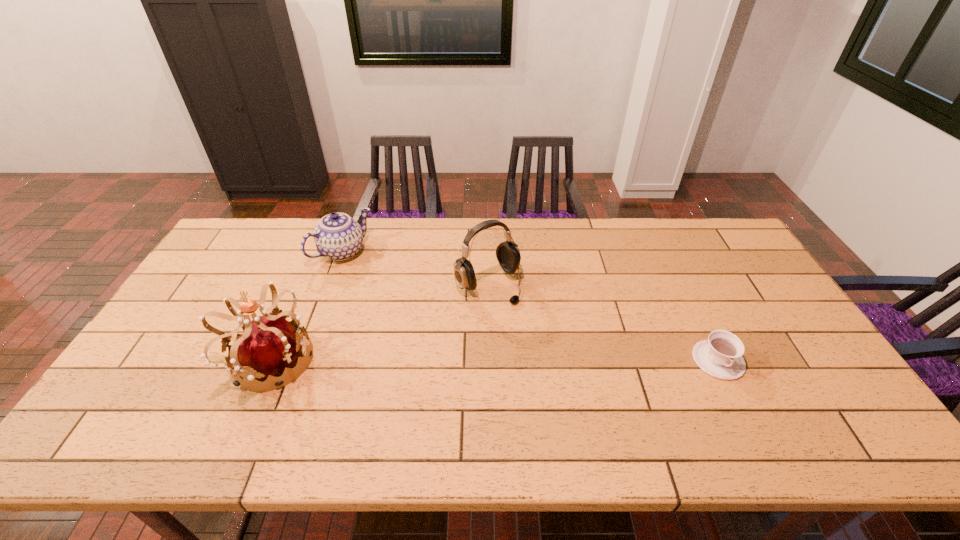
Find the location of a particular element. tiara is located at coordinates [x=270, y=344].

Locate an element on the screen. Image resolution: width=960 pixels, height=540 pixels. teacup is located at coordinates [x=720, y=356].

Locate an element on the screen. The image size is (960, 540). the shortest object is located at coordinates (720, 356).

What are the coordinates of `headset` in the screenshot? It's located at (508, 255).

Locate an element on the screen. The height and width of the screenshot is (540, 960). the third tallest object is located at coordinates (337, 236).

Identify the location of vacant space situated 0.050m on the front-facing side of the tiara. (335, 360).

The height and width of the screenshot is (540, 960). I want to click on free space located with the microphone on the side of the headset, so click(x=587, y=392).

This screenshot has height=540, width=960. Identify the location of free region located with the microphone on the side of the headset. (520, 318).

Where is `free space located with the microphone on the side of the headset`? free space located with the microphone on the side of the headset is located at coordinates (579, 383).

At what (x,y) coordinates should I click in order to perform the action: click on free point located at the spout of the chinaware. Please return your answer as a coordinate pair (x, y). Looking at the image, I should click on (385, 290).